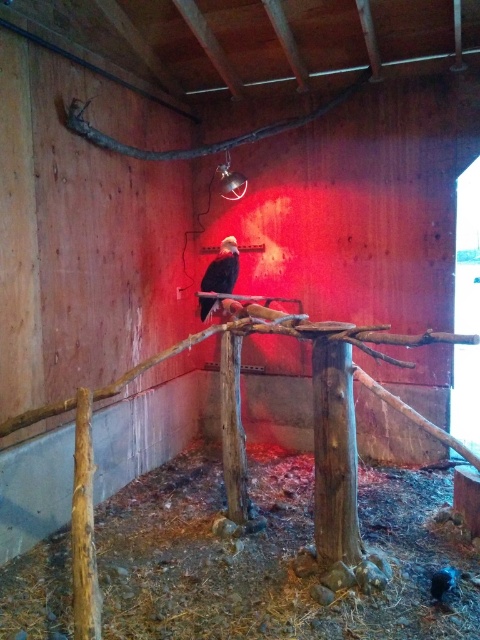
Question: Among these points, which one is nearest to the camera?

Choices:
 (A) (321, 106)
 (B) (220, 260)

Answer: (B)

Question: Where is brown rough branch at upper center located in relation to black feathered bird at center in the image?

Choices:
 (A) left
 (B) right

Answer: (B)

Question: Can you confirm if brown rough branch at upper center is positioned below black feathered bird at center?

Choices:
 (A) yes
 (B) no

Answer: (B)

Question: Does brown rough branch at upper center appear on the left side of black feathered bird at center?

Choices:
 (A) yes
 (B) no

Answer: (B)

Question: Which of the following is the closest to the observer?

Choices:
 (A) (205, 305)
 (B) (352, 88)

Answer: (B)